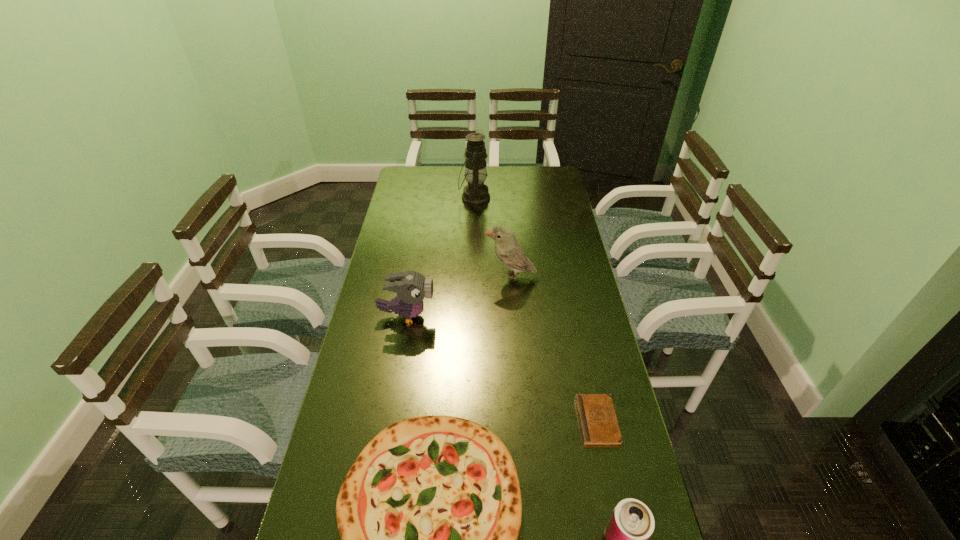
Find the location of a particular element. The width and height of the screenshot is (960, 540). vacant space that satisfies the following two spatial constraints: 1. on the front side of the farthest object; 2. at the beak of the shorter bird is located at coordinates (472, 316).